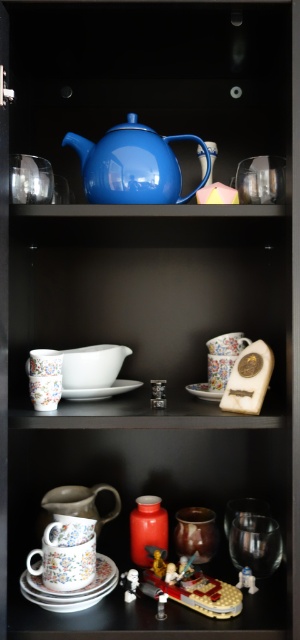
Does point (107, 589) lie in front of point (102, 390)?

Yes, point (107, 589) is in front of point (102, 390).

Does floral ceramic saucer at lower center appear under white matte saucer at center?

Correct, floral ceramic saucer at lower center is located below white matte saucer at center.

Which is in front, point (45, 600) or point (119, 388)?

Point (45, 600) is in front.

This screenshot has width=300, height=640. Identify the location of floral ceramic saucer at lower center. (75, 589).

Who is lower down, white matte saucer at center or white glossy saucer at center?

Positioned lower is white glossy saucer at center.

Based on the photo, does white matte saucer at center have a greater width compared to white glossy saucer at center?

Yes.

Is point (77, 397) positioned behind point (209, 387)?

No, it is not.

This screenshot has width=300, height=640. I want to click on white matte saucer at center, so click(99, 390).

Which is in front, point (87, 150) or point (134, 387)?

Point (87, 150)

Is blue glossy teapot at upper center taller than white matte saucer at center?

Indeed, blue glossy teapot at upper center has a greater height compared to white matte saucer at center.

Find the location of a particular element. This screenshot has height=640, width=300. blue glossy teapot at upper center is located at coordinates (132, 164).